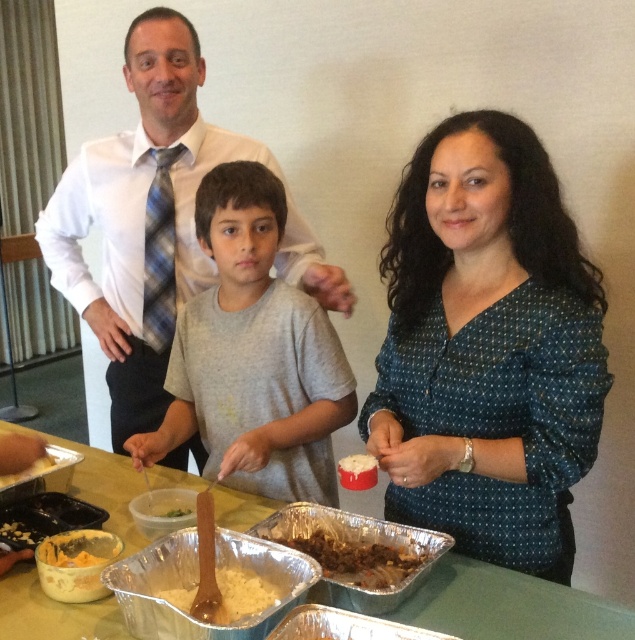
Where is `metallic silver tray at center`? The width and height of the screenshot is (635, 640). metallic silver tray at center is located at coordinates (509, 605).

Is metallic silver tray at center positioned before white fluffy rice at center?

No, it is not.

What do you see at coordinates (509, 605) in the screenshot? I see `metallic silver tray at center` at bounding box center [509, 605].

Locate an element on the screen. metallic silver tray at center is located at coordinates (509, 605).

In the scene shown: Is white fluffy rice at center wider than orange creamy dip at center?

Indeed, white fluffy rice at center has a greater width compared to orange creamy dip at center.

Who is lower down, white fluffy rice at center or orange creamy dip at center?

Positioned lower is white fluffy rice at center.

Is point (189, 588) less distant than point (62, 540)?

That is True.

The image size is (635, 640). What are the coordinates of `white fluffy rice at center` in the screenshot? It's located at (227, 596).

What do you see at coordinates (345, 550) in the screenshot?
I see `brown matte aluminum tray at center` at bounding box center [345, 550].

Between brown matte aluminum tray at center and white creamy substance at center, which one appears on the left side from the viewer's perspective?

From the viewer's perspective, brown matte aluminum tray at center appears more on the left side.

Does point (283, 534) come farther from viewer compared to point (349, 467)?

Yes, point (283, 534) is farther from viewer.

Where is `brown matte aluminum tray at center`? The image size is (635, 640). brown matte aluminum tray at center is located at coordinates (345, 550).